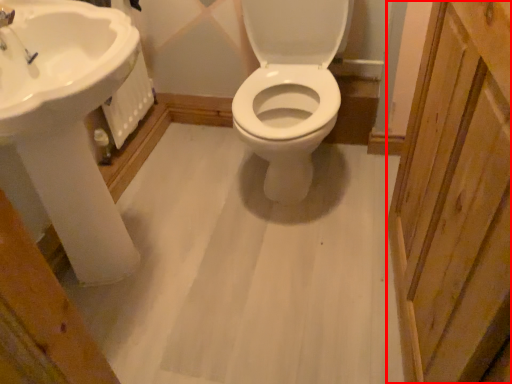
Question: From the image's perspective, where is screen door (annotated by the red box) located in relation to sink in the image?

Choices:
 (A) above
 (B) below

Answer: (B)